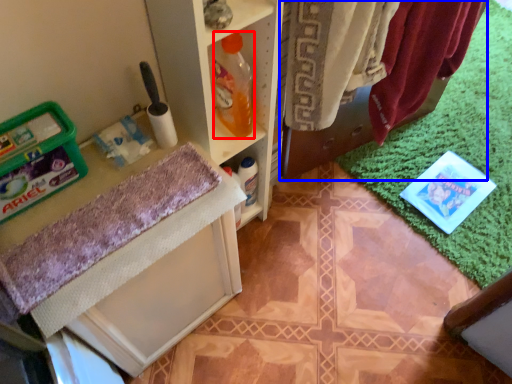
Question: Which of the following is the closest to the observer, bottle (highlighted by a red box) or laundry (highlighted by a blue box)?

Choices:
 (A) bottle
 (B) laundry

Answer: (B)